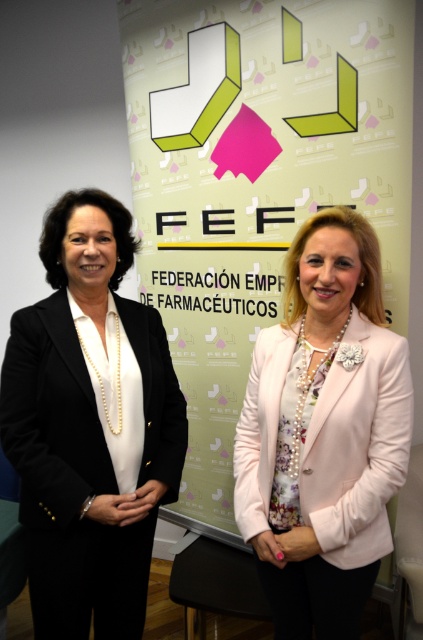
Question: Can you confirm if black matte blazer at left is wider than pink satin blazer at center?

Choices:
 (A) yes
 (B) no

Answer: (A)

Question: Does black matte blazer at left appear on the left side of pink satin blazer at center?

Choices:
 (A) no
 (B) yes

Answer: (B)

Question: In this image, where is black matte blazer at left located relative to pink satin blazer at center?

Choices:
 (A) left
 (B) right

Answer: (A)